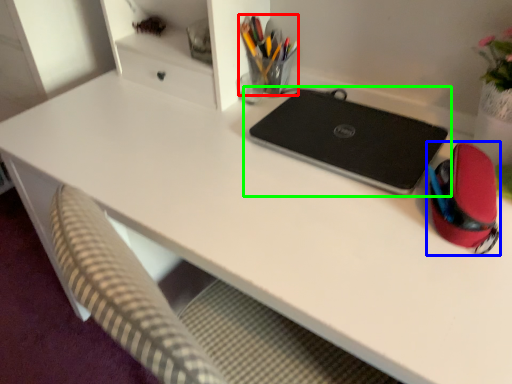
Question: Estimate the real-world distances between objects in this image. Which object is farther from stationery (highlighted by a red box), stationery (highlighted by a blue box) or laptop (highlighted by a green box)?

Choices:
 (A) stationery
 (B) laptop

Answer: (A)